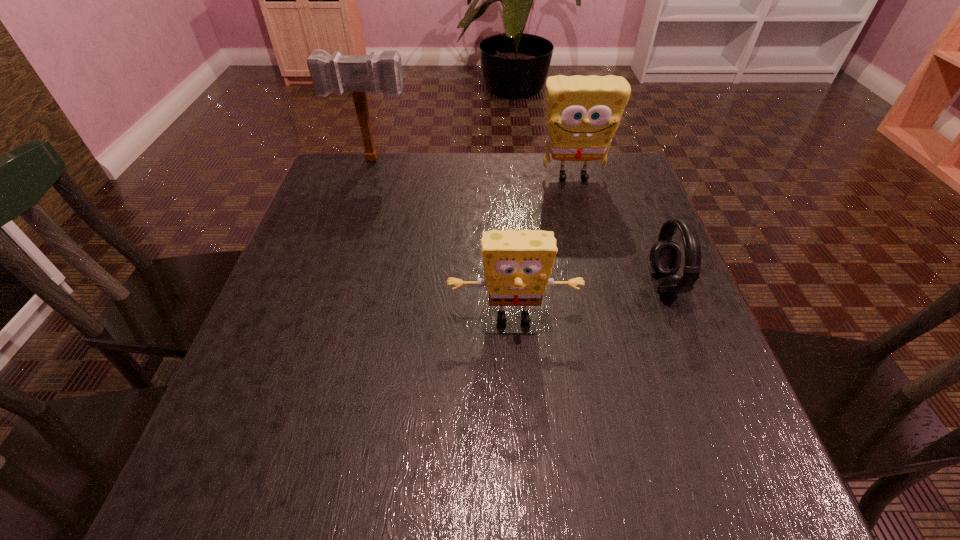
Locate an element on the screen. the farthest object is located at coordinates (358, 74).

The image size is (960, 540). Identify the location of mallet. (358, 74).

Locate an element on the screen. The width and height of the screenshot is (960, 540). the taller sponge is located at coordinates click(583, 113).

The height and width of the screenshot is (540, 960). Find the location of `the third nearest object`. the third nearest object is located at coordinates (583, 113).

Where is `the shorter sponge`? The width and height of the screenshot is (960, 540). the shorter sponge is located at coordinates (517, 265).

Where is `the nearer sponge`? The image size is (960, 540). the nearer sponge is located at coordinates (517, 265).

Identify the location of headset. [x=665, y=255].

You are a GUI agent. You are given a task and a screenshot of the screen. Output one action in this format:
    pyautogui.click(x=<x>, y=<y>)
    Task: Click on the shortest object
    The width and height of the screenshot is (960, 540).
    Given the screenshot: What is the action you would take?
    pyautogui.click(x=665, y=255)

Identify the location of free space located 0.130m on the right of the leftmost object. This screenshot has width=960, height=540. (458, 160).

Find the location of a particular element. This screenshot has height=540, width=960. free space located 0.260m on the face of the second farthest object is located at coordinates (594, 258).